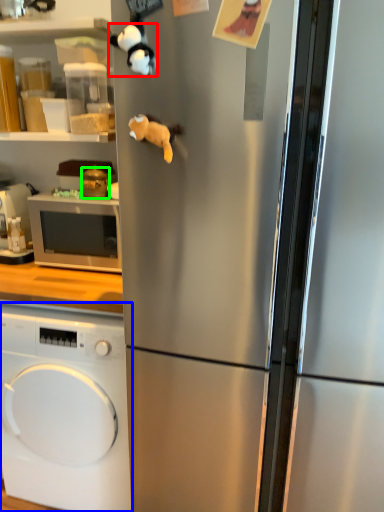
Question: Considering the real-world distances, which object is closest to animal (highlighted by a red box)? washing machine (highlighted by a blue box) or appliance (highlighted by a green box).

Choices:
 (A) washing machine
 (B) appliance

Answer: (B)